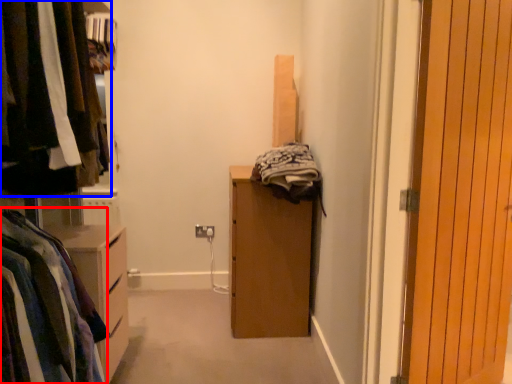
Question: Which object appears farthest to the camera in this image, clothing (highlighted by a red box) or closet (highlighted by a blue box)?

Choices:
 (A) clothing
 (B) closet

Answer: (A)